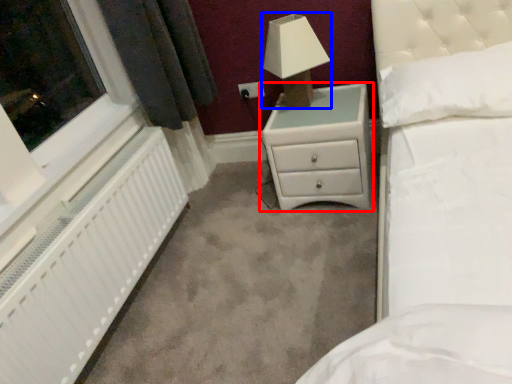
Question: Which object is closer to the camera taking this photo, chest of drawers (highlighted by a red box) or lamp (highlighted by a blue box)?

Choices:
 (A) chest of drawers
 (B) lamp

Answer: (B)